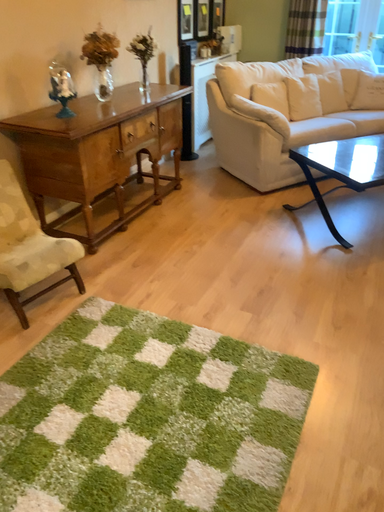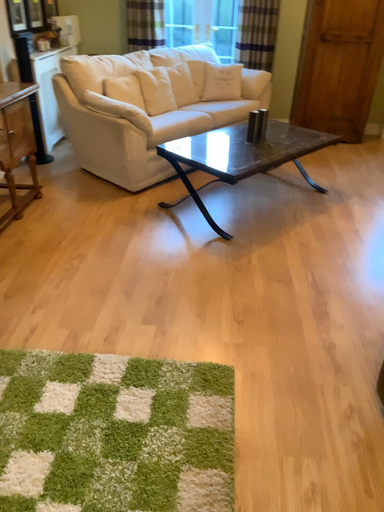
Question: Which way did the camera rotate in the video?

Choices:
 (A) rotated right
 (B) rotated left

Answer: (A)